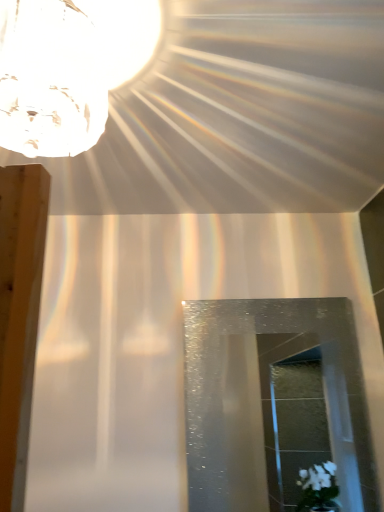
What is the approximate height of crystal glass lampshade at upper left?

crystal glass lampshade at upper left is 10.05 inches tall.

Measure the distance between point (62, 12) and camera.

The depth of point (62, 12) is 32.68 inches.

What do you see at coordinates (49, 79) in the screenshot? The height and width of the screenshot is (512, 384). I see `crystal glass lampshade at upper left` at bounding box center [49, 79].

At what (x,y) coordinates should I click in order to perform the action: click on crystal glass lampshade at upper left. Please return your answer as a coordinate pair (x, y). The image size is (384, 512). Looking at the image, I should click on (49, 79).

This screenshot has width=384, height=512. What do you see at coordinates (268, 399) in the screenshot? I see `transparent textured glass door at center` at bounding box center [268, 399].

Measure the distance between point (x=351, y=436) and camera.

Point (x=351, y=436) is 1.37 meters from camera.

Identify the location of transparent textured glass door at center. (268, 399).

This screenshot has width=384, height=512. I want to click on crystal glass lampshade at upper left, so click(x=49, y=79).

Visually, is crystal glass lampshade at upper left positioned to the left or to the right of transparent textured glass door at center?

crystal glass lampshade at upper left is to the left of transparent textured glass door at center.

Consider the image. Which is in front, crystal glass lampshade at upper left or transparent textured glass door at center?

crystal glass lampshade at upper left is in front.

Considering the positions of points (107, 96) and (326, 333), is point (107, 96) farther from camera compared to point (326, 333)?

No, it is not.

From the image's perspective, is crystal glass lampshade at upper left over transparent textured glass door at center?

Correct, crystal glass lampshade at upper left appears higher than transparent textured glass door at center in the image.

From a real-world perspective, which object rests below the other?

In real-world perspective, transparent textured glass door at center is lower.

Looking at this image, considering the sizes of crystal glass lampshade at upper left and transparent textured glass door at center in the image, is crystal glass lampshade at upper left wider or thinner than transparent textured glass door at center?

Clearly, crystal glass lampshade at upper left has more width compared to transparent textured glass door at center.

Can you confirm if crystal glass lampshade at upper left is taller than transparent textured glass door at center?

No.

Looking at the image, does crystal glass lampshade at upper left seem bigger or smaller compared to transparent textured glass door at center?

crystal glass lampshade at upper left is bigger than transparent textured glass door at center.

Could transparent textured glass door at center be considered to be inside crystal glass lampshade at upper left?

No, crystal glass lampshade at upper left does not contain transparent textured glass door at center.

Is crystal glass lampshade at upper left in contact with transparent textured glass door at center?

No.

Is crystal glass lampshade at upper left facing towards transparent textured glass door at center?

No, crystal glass lampshade at upper left is not oriented towards transparent textured glass door at center.

How many degrees apart are the facing directions of crystal glass lampshade at upper left and transparent textured glass door at center?

The angular difference between crystal glass lampshade at upper left and transparent textured glass door at center is 92.5 degrees.

How much distance is there between crystal glass lampshade at upper left and transparent textured glass door at center?

1.68 meters.

The width and height of the screenshot is (384, 512). I want to click on lamp on the left of transparent textured glass door at center, so click(49, 79).

Considering the relative positions of transparent textured glass door at center and crystal glass lampshade at upper left in the image provided, is transparent textured glass door at center to the right of crystal glass lampshade at upper left from the viewer's perspective?

Yes, transparent textured glass door at center is to the right of crystal glass lampshade at upper left.

Is transparent textured glass door at center further to the viewer compared to crystal glass lampshade at upper left?

That is True.

Considering the points (353, 394) and (57, 125), which point is behind, point (353, 394) or point (57, 125)?

Positioned behind is point (353, 394).

From the image's perspective, does transparent textured glass door at center appear lower than crystal glass lampshade at upper left?

Yes, from the image's perspective, transparent textured glass door at center is beneath crystal glass lampshade at upper left.

From the picture: From a real-world perspective, which is physically below, transparent textured glass door at center or crystal glass lampshade at upper left?

In real-world perspective, transparent textured glass door at center is lower.

Which object is wider, transparent textured glass door at center or crystal glass lampshade at upper left?

crystal glass lampshade at upper left is wider.

From their relative heights in the image, would you say transparent textured glass door at center is taller or shorter than crystal glass lampshade at upper left?

Clearly, transparent textured glass door at center is taller compared to crystal glass lampshade at upper left.

Which of these two, transparent textured glass door at center or crystal glass lampshade at upper left, is bigger?

crystal glass lampshade at upper left.

Is crystal glass lampshade at upper left a part of transparent textured glass door at center?

No.

Is the surface of transparent textured glass door at center in direct contact with crystal glass lampshade at upper left?

No, transparent textured glass door at center is not beside crystal glass lampshade at upper left.

Is transparent textured glass door at center positioned with its back to crystal glass lampshade at upper left?

No, transparent textured glass door at center's orientation is not away from crystal glass lampshade at upper left.

How different are the orientations of transparent textured glass door at center and crystal glass lampshade at upper left in degrees?

92.5 degrees separate the facing orientations of transparent textured glass door at center and crystal glass lampshade at upper left.

I want to click on glass door below the crystal glass lampshade at upper left (from a real-world perspective), so click(x=268, y=399).

What are the coordinates of `lamp that appears in front of the transparent textured glass door at center` in the screenshot? It's located at (49, 79).

What are the coordinates of `lamp above the transparent textured glass door at center (from the image's perspective)` in the screenshot? It's located at (49, 79).